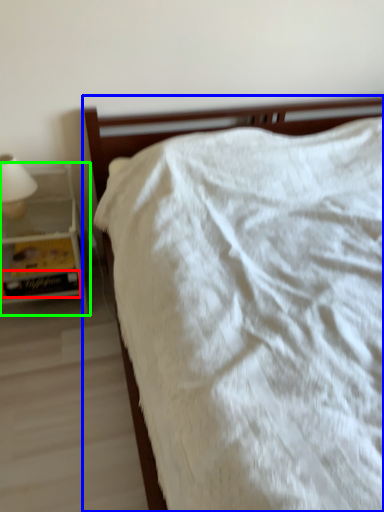
Question: Which object is positioned farthest from paperback book (highlighted by a red box)? Select from bed (highlighted by a blue box) and nightstand (highlighted by a green box).

Choices:
 (A) bed
 (B) nightstand

Answer: (A)